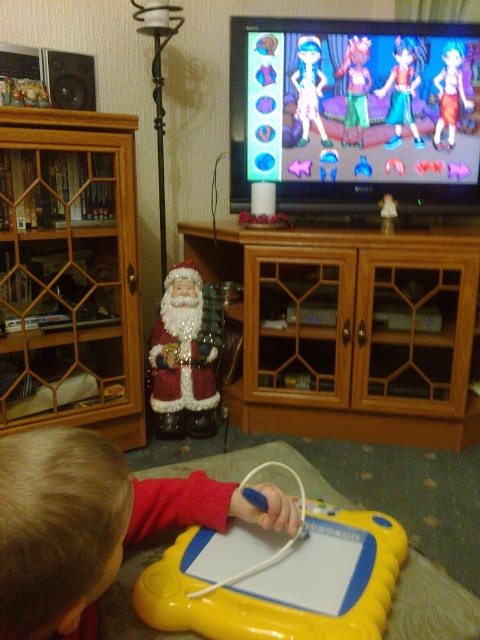
You are a parent trying to place a new toy on the smooth yellow tablet at lower center. However, there is a wooden cabinet at center nearby. Where should you place the toy to ensure it stays on the tablet and not on the cabinet?

Place the toy on the left side of the smooth yellow tablet at lower center since the wooden cabinet at center is on its right side, so the left side is farther from the cabinet and less likely to have the toy fall onto it.

You want to place the smooth yellow tablet at lower center on top of the wooden cabinet at center. Considering their sizes, will the tablet fit entirely on the cabinet without hanging over the edges?

The wooden cabinet at center is wider than the smooth yellow tablet at lower center, so the tablet should fit entirely on the cabinet without overhanging the edges.

You are standing in the living room and want to place a new book on the wooden cabinet at center. Where exactly should you place it?

You should place the new book on the wooden cabinet at center located at point (348, 333).